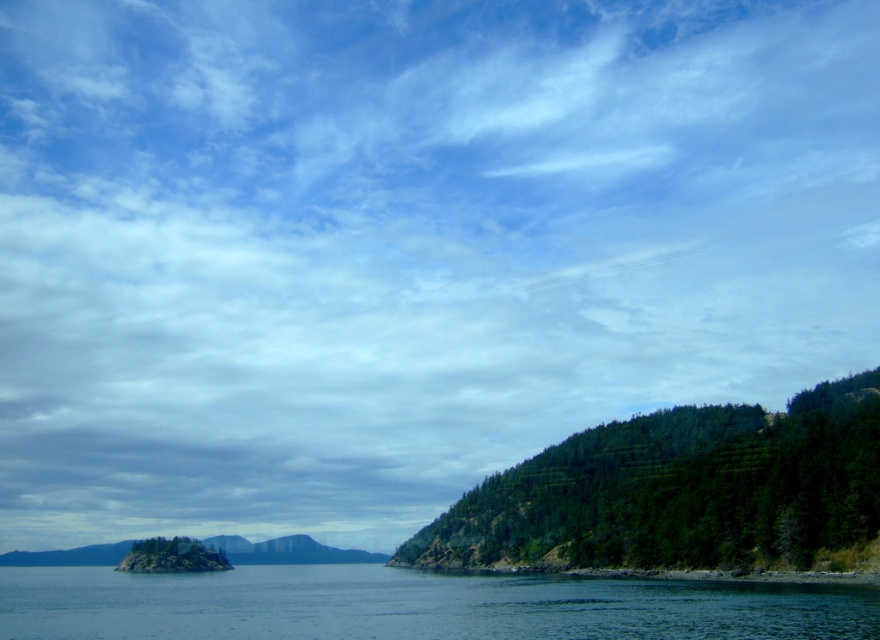
You are a bird flying over the coastal landscape. You see the point at coordinates (416,605). Where is this point located in the scene?

The point at coordinates (416,605) is located on clear blue water at lower center.

You are standing at the center of the image and want to reach the green textured hillside at right. Which direction should you move in?

You should move to the right direction to reach the green textured hillside at right since it is located at the right side of the image.

You are a photographer planning to capture the green textured hillside at right and the clear blue water at lower center in a single shot. Which of these two elements will occupy more of the frame in your photograph?

The clear blue water at lower center will occupy more of the frame because it is larger than the green textured hillside at right.